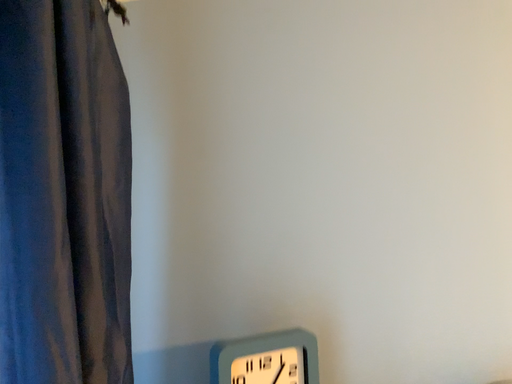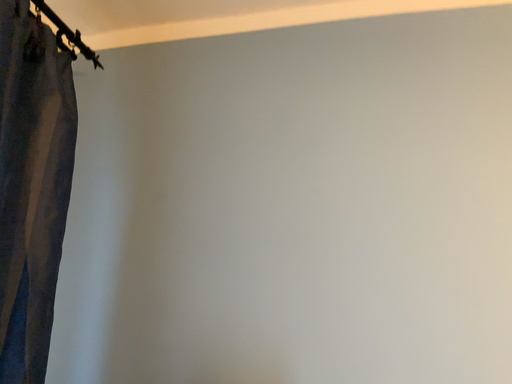
Question: Which way did the camera rotate in the video?

Choices:
 (A) rotated upward
 (B) rotated downward

Answer: (A)